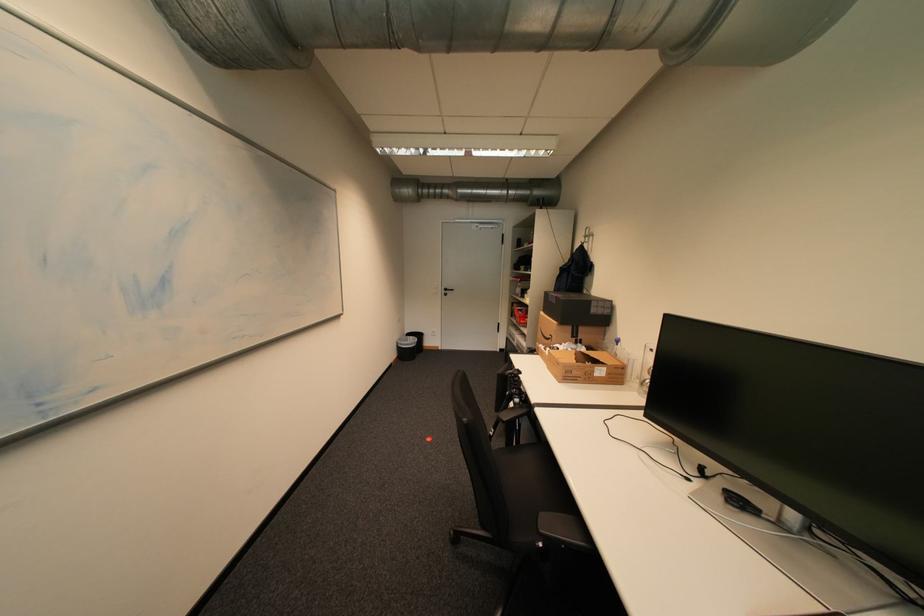
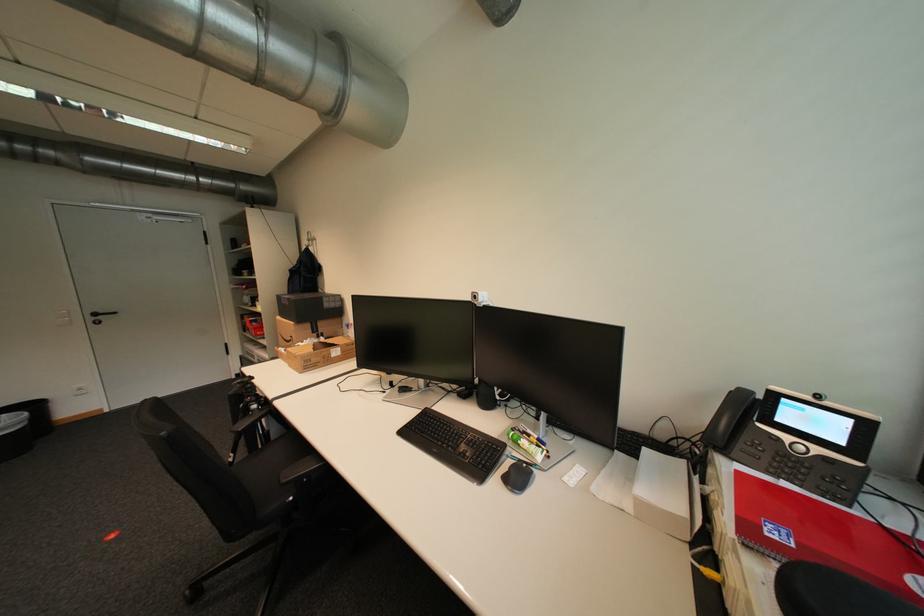
Question: How did the camera likely rotate?

Choices:
 (A) Left
 (B) Right
 (C) Up
 (D) Down

Answer: (B)